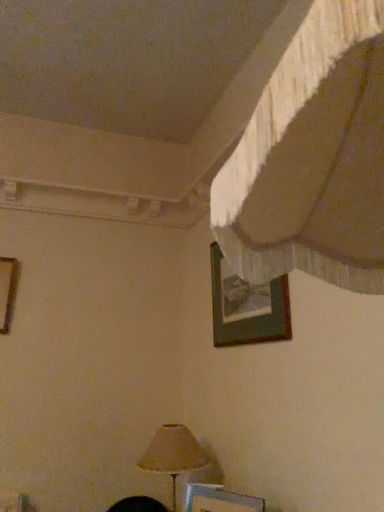
Describe the element at coordinates (7, 291) in the screenshot. I see `wooden picture frame at left, positioned as the second picture frame in bottom-to-top order` at that location.

What is the approximate width of matte beige lampshade at lower center?

matte beige lampshade at lower center is 11.35 inches wide.

How much space does metallic silver picture frame at lower center, which is the second picture frame from left to right, occupy horizontally?

metallic silver picture frame at lower center, which is the second picture frame from left to right, is 2.29 inches wide.

What are the coordinates of `wooden picture frame at left, which ranks as the first picture frame in left-to-right order` in the screenshot? It's located at (7, 291).

Does metallic silver picture frame at lower center, the 1th picture frame when ordered from bottom to top, turn towards wooden picture frame at left, arranged as the third picture frame when viewed from the right?

No, metallic silver picture frame at lower center, the 1th picture frame when ordered from bottom to top, is not facing towards wooden picture frame at left, arranged as the third picture frame when viewed from the right.

Is metallic silver picture frame at lower center, which is the 3th picture frame in top-to-bottom order, bigger or smaller than wooden picture frame at left, which ranks as the first picture frame in left-to-right order?

metallic silver picture frame at lower center, which is the 3th picture frame in top-to-bottom order, is smaller than wooden picture frame at left, which ranks as the first picture frame in left-to-right order.

At what (x,y) coordinates should I click in order to perform the action: click on the 2nd picture frame behind the metallic silver picture frame at lower center, the 2th picture frame positioned from the right, counting from the anchor's position. Please return your answer as a coordinate pair (x, y). This screenshot has height=512, width=384. Looking at the image, I should click on (7, 291).

Can you tell me how much metallic silver picture frame at lower center, which is the second picture frame from left to right, and wooden picture frame at left, which ranks as the first picture frame in left-to-right order, differ in facing direction?

The angular difference between metallic silver picture frame at lower center, which is the second picture frame from left to right, and wooden picture frame at left, which ranks as the first picture frame in left-to-right order, is 59.3 degrees.

Does metallic silver picture frame at lower center, the 2th picture frame positioned from the right, come behind matte beige lampshade at lower center?

That is False.

From the image's perspective, would you say metallic silver picture frame at lower center, the 1th picture frame when ordered from bottom to top, is shown under matte beige lampshade at lower center?

No.

Which object is wider, metallic silver picture frame at lower center, which is the 3th picture frame in top-to-bottom order, or matte beige lampshade at lower center?

matte beige lampshade at lower center.

From a real-world perspective, between metallic silver picture frame at lower center, which is the 3th picture frame in top-to-bottom order, and matte beige lampshade at lower center, who is vertically lower?

From a 3D spatial view, metallic silver picture frame at lower center, which is the 3th picture frame in top-to-bottom order, is below.

Can you confirm if wooden picture frame at upper center, which ranks as the third picture frame in bottom-to-top order, is bigger than matte beige lampshade at lower center?

Incorrect, wooden picture frame at upper center, which ranks as the third picture frame in bottom-to-top order, is not larger than matte beige lampshade at lower center.

From a real-world perspective, between wooden picture frame at upper center, placed as the first picture frame when sorted from right to left, and matte beige lampshade at lower center, who is vertically higher?

wooden picture frame at upper center, placed as the first picture frame when sorted from right to left, from a real-world perspective.

From the image's perspective, who appears lower, wooden picture frame at upper center, which ranks as the third picture frame in bottom-to-top order, or matte beige lampshade at lower center?

matte beige lampshade at lower center.

Based on the photo, what's the angular difference between metallic silver picture frame at lower center, which is the second picture frame from left to right, and wooden picture frame at upper center, placed as the first picture frame when sorted from right to left,'s facing directions?

29.5 degrees.

From the image's perspective, count 2nd picture frames downward from the wooden picture frame at upper center, which is counted as the third picture frame, starting from the left, and point to it. Please provide its 2D coordinates.

[(219, 500)]

Which object is positioned more to the right, metallic silver picture frame at lower center, which is the 3th picture frame in top-to-bottom order, or wooden picture frame at upper center, which is the first picture frame from top to bottom?

wooden picture frame at upper center, which is the first picture frame from top to bottom, is more to the right.

In the scene shown: Is metallic silver picture frame at lower center, the 1th picture frame when ordered from bottom to top, wider or thinner than wooden picture frame at upper center, which ranks as the third picture frame in bottom-to-top order?

In the image, metallic silver picture frame at lower center, the 1th picture frame when ordered from bottom to top, appears to be wider than wooden picture frame at upper center, which ranks as the third picture frame in bottom-to-top order.

From the picture: From a real-world perspective, is wooden picture frame at upper center, which ranks as the third picture frame in bottom-to-top order, under metallic silver picture frame at lower center, the 2th picture frame positioned from the right?

Actually, wooden picture frame at upper center, which ranks as the third picture frame in bottom-to-top order, is physically above metallic silver picture frame at lower center, the 2th picture frame positioned from the right, in the real world.

Considering the relative sizes of wooden picture frame at upper center, which ranks as the third picture frame in bottom-to-top order, and metallic silver picture frame at lower center, the 2th picture frame positioned from the right, in the image provided, is wooden picture frame at upper center, which ranks as the third picture frame in bottom-to-top order, shorter than metallic silver picture frame at lower center, the 2th picture frame positioned from the right,?

No, wooden picture frame at upper center, which ranks as the third picture frame in bottom-to-top order, is not shorter than metallic silver picture frame at lower center, the 2th picture frame positioned from the right.

Based on the photo, is wooden picture frame at upper center, placed as the first picture frame when sorted from right to left, looking in the opposite direction of metallic silver picture frame at lower center, which is the second picture frame from left to right?

No.

Is there a large distance between wooden picture frame at upper center, placed as the first picture frame when sorted from right to left, and metallic silver picture frame at lower center, the 1th picture frame when ordered from bottom to top?

They are positioned close to each other.

Relative to wooden picture frame at upper center, which is the first picture frame from top to bottom, is wooden picture frame at left, arranged as the third picture frame when viewed from the right, in front or behind?

wooden picture frame at left, arranged as the third picture frame when viewed from the right, is positioned farther from the viewer than wooden picture frame at upper center, which is the first picture frame from top to bottom.

Can you see wooden picture frame at left, which ranks as the first picture frame in left-to-right order, touching wooden picture frame at upper center, which is the first picture frame from top to bottom?

wooden picture frame at left, which ranks as the first picture frame in left-to-right order, is not next to wooden picture frame at upper center, which is the first picture frame from top to bottom, and they're not touching.

Which point is more forward, (13,292) or (233,335)?

The point (233,335) is closer.

Between point (5, 305) and point (218, 511), which one is positioned in front?

The point (218, 511) is closer.

Considering the sizes of objects wooden picture frame at left, which is the 2th picture frame in top-to-bottom order, and metallic silver picture frame at lower center, the 2th picture frame positioned from the right, in the image provided, who is taller, wooden picture frame at left, which is the 2th picture frame in top-to-bottom order, or metallic silver picture frame at lower center, the 2th picture frame positioned from the right,?

With more height is wooden picture frame at left, which is the 2th picture frame in top-to-bottom order.

Considering the relative positions of wooden picture frame at left, arranged as the third picture frame when viewed from the right, and metallic silver picture frame at lower center, the 1th picture frame when ordered from bottom to top, in the image provided, is wooden picture frame at left, arranged as the third picture frame when viewed from the right, to the right of metallic silver picture frame at lower center, the 1th picture frame when ordered from bottom to top, from the viewer's perspective?

Incorrect, wooden picture frame at left, arranged as the third picture frame when viewed from the right, is not on the right side of metallic silver picture frame at lower center, the 1th picture frame when ordered from bottom to top.

Is metallic silver picture frame at lower center, the 1th picture frame when ordered from bottom to top, at the back of wooden picture frame at left, which is the 2th picture frame in top-to-bottom order?

wooden picture frame at left, which is the 2th picture frame in top-to-bottom order, is not turned away from metallic silver picture frame at lower center, the 1th picture frame when ordered from bottom to top.

Which picture frame is the 1st one when counting from the right side of the wooden picture frame at left, which is the 2th picture frame in top-to-bottom order? Please provide its 2D coordinates.

[(219, 500)]

From the image's perspective, count 1st picture frames upward from the matte beige lampshade at lower center and point to it. Please provide its 2D coordinates.

[(219, 500)]

When comparing their distances from metallic silver picture frame at lower center, which is the 3th picture frame in top-to-bottom order, does wooden picture frame at left, arranged as the third picture frame when viewed from the right, or wooden picture frame at upper center, placed as the first picture frame when sorted from right to left, seem further?

wooden picture frame at left, arranged as the third picture frame when viewed from the right, is further to metallic silver picture frame at lower center, which is the 3th picture frame in top-to-bottom order.

When comparing their distances from metallic silver picture frame at lower center, the 2th picture frame positioned from the right, does wooden picture frame at upper center, placed as the first picture frame when sorted from right to left, or wooden picture frame at left, arranged as the third picture frame when viewed from the right, seem closer?

wooden picture frame at upper center, placed as the first picture frame when sorted from right to left, lies closer to metallic silver picture frame at lower center, the 2th picture frame positioned from the right, than the other object.

Based on their spatial positions, is matte beige lampshade at lower center or wooden picture frame at left, arranged as the third picture frame when viewed from the right, further from metallic silver picture frame at lower center, which is the 3th picture frame in top-to-bottom order?

wooden picture frame at left, arranged as the third picture frame when viewed from the right, is positioned further to the anchor metallic silver picture frame at lower center, which is the 3th picture frame in top-to-bottom order.

Estimate the real-world distances between objects in this image. Which object is further from wooden picture frame at left, which is the 2th picture frame in top-to-bottom order, metallic silver picture frame at lower center, the 1th picture frame when ordered from bottom to top, or matte beige lampshade at lower center?

metallic silver picture frame at lower center, the 1th picture frame when ordered from bottom to top, is positioned further to the anchor wooden picture frame at left, which is the 2th picture frame in top-to-bottom order.

Estimate the real-world distances between objects in this image. Which object is further from wooden picture frame at left, which ranks as the first picture frame in left-to-right order, matte beige lampshade at lower center or metallic silver picture frame at lower center, the 1th picture frame when ordered from bottom to top?

Based on the image, metallic silver picture frame at lower center, the 1th picture frame when ordered from bottom to top, appears to be further to wooden picture frame at left, which ranks as the first picture frame in left-to-right order.

Based on the photo, from the image, which object appears to be nearer to matte beige lampshade at lower center, wooden picture frame at left, positioned as the second picture frame in bottom-to-top order, or wooden picture frame at upper center, which is counted as the third picture frame, starting from the left?

wooden picture frame at upper center, which is counted as the third picture frame, starting from the left, lies closer to matte beige lampshade at lower center than the other object.

When comparing their distances from wooden picture frame at left, which is the 2th picture frame in top-to-bottom order, does wooden picture frame at upper center, placed as the first picture frame when sorted from right to left, or metallic silver picture frame at lower center, which is the 3th picture frame in top-to-bottom order, seem further?

Among the two, metallic silver picture frame at lower center, which is the 3th picture frame in top-to-bottom order, is located further to wooden picture frame at left, which is the 2th picture frame in top-to-bottom order.

Estimate the real-world distances between objects in this image. Which object is further from wooden picture frame at upper center, which is the first picture frame from top to bottom, matte beige lampshade at lower center or metallic silver picture frame at lower center, which is the 3th picture frame in top-to-bottom order?

metallic silver picture frame at lower center, which is the 3th picture frame in top-to-bottom order, is further to wooden picture frame at upper center, which is the first picture frame from top to bottom.

Locate an element on the screen. This screenshot has height=512, width=384. lamp between wooden picture frame at left, which ranks as the first picture frame in left-to-right order, and metallic silver picture frame at lower center, the 1th picture frame when ordered from bottom to top, from left to right is located at coordinates (173, 454).

You are a GUI agent. You are given a task and a screenshot of the screen. Output one action in this format:
    pyautogui.click(x=<x>, y=<y>)
    Task: Click on the picture frame between wooden picture frame at left, arranged as the third picture frame when viewed from the right, and wooden picture frame at upper center, which is counted as the third picture frame, starting from the left
    
    Given the screenshot: What is the action you would take?
    pyautogui.click(x=219, y=500)

You are a GUI agent. You are given a task and a screenshot of the screen. Output one action in this format:
    pyautogui.click(x=<x>, y=<y>)
    Task: Click on the lamp between wooden picture frame at left, positioned as the second picture frame in bottom-to-top order, and wooden picture frame at upper center, placed as the first picture frame when sorted from right to left
    The height and width of the screenshot is (512, 384).
    Given the screenshot: What is the action you would take?
    173,454